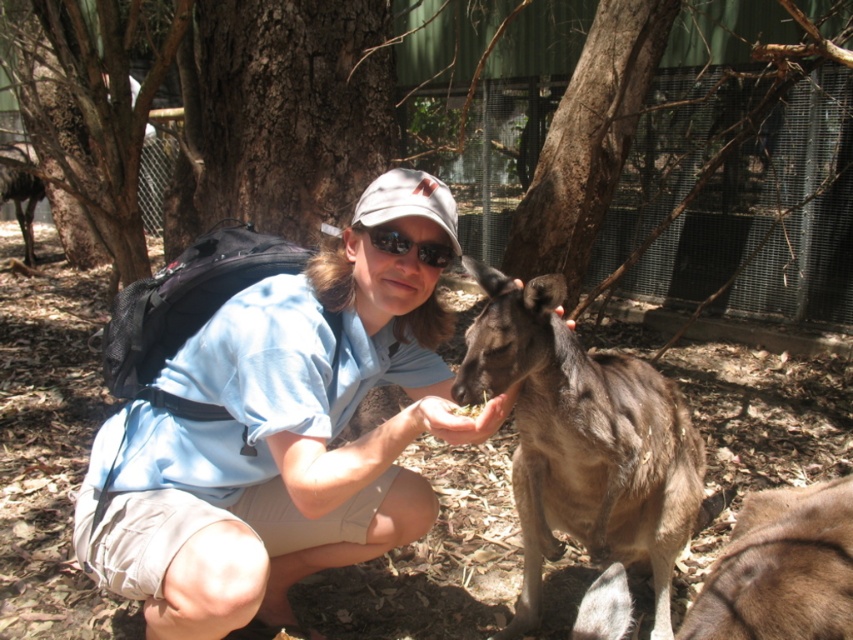
Does blue fabric shirt at center lie behind black reflective sunglasses at center?

No, blue fabric shirt at center is in front of black reflective sunglasses at center.

Between blue fabric shirt at center and black reflective sunglasses at center, which one appears on the right side from the viewer's perspective?

Positioned to the right is black reflective sunglasses at center.

This screenshot has width=853, height=640. In order to click on blue fabric shirt at center in this screenshot , I will do `click(282, 433)`.

Is blue fabric shirt at center positioned in front of brown furry kangaroo at center?

That is False.

Between blue fabric shirt at center and brown furry kangaroo at center, which one has less height?

With less height is brown furry kangaroo at center.

Is point (273, 589) positioned in front of point (473, 333)?

No, it is behind (473, 333).

Find the location of a particular element. Image resolution: width=853 pixels, height=640 pixels. blue fabric shirt at center is located at coordinates (282, 433).

Is point (698, 481) positioned after point (450, 257)?

Yes.

Describe the element at coordinates (582, 440) in the screenshot. I see `brown furry kangaroo at center` at that location.

Which is behind, point (646, 544) or point (387, 227)?

Point (646, 544)

The image size is (853, 640). I want to click on brown furry kangaroo at center, so click(582, 440).